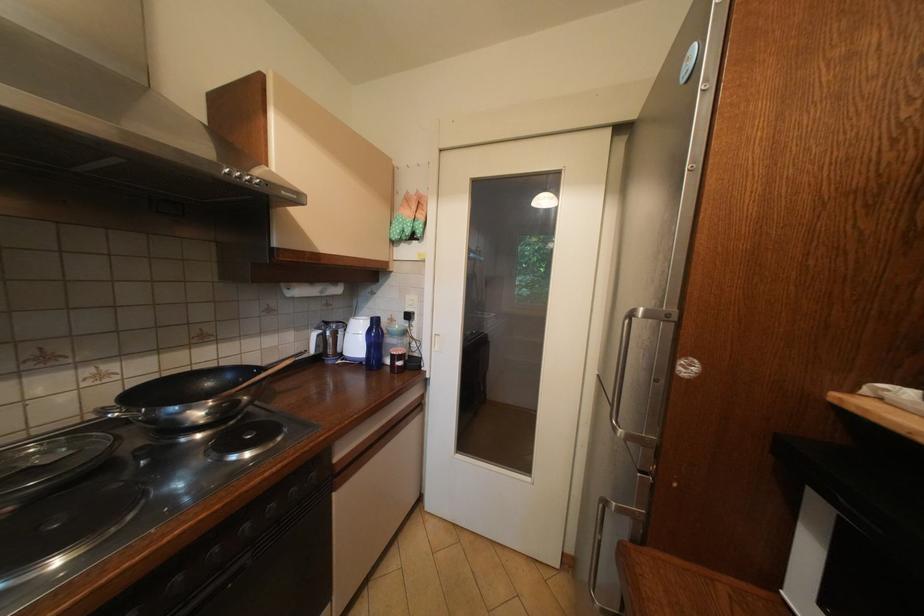
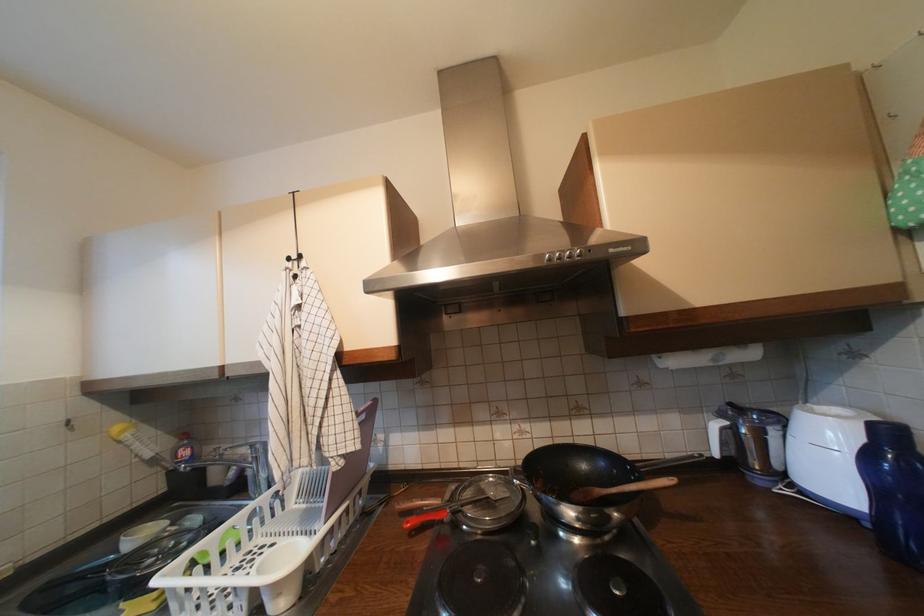
The point at (248, 179) is marked in the first image. Where is the corresponding point in the second image?

(568, 259)